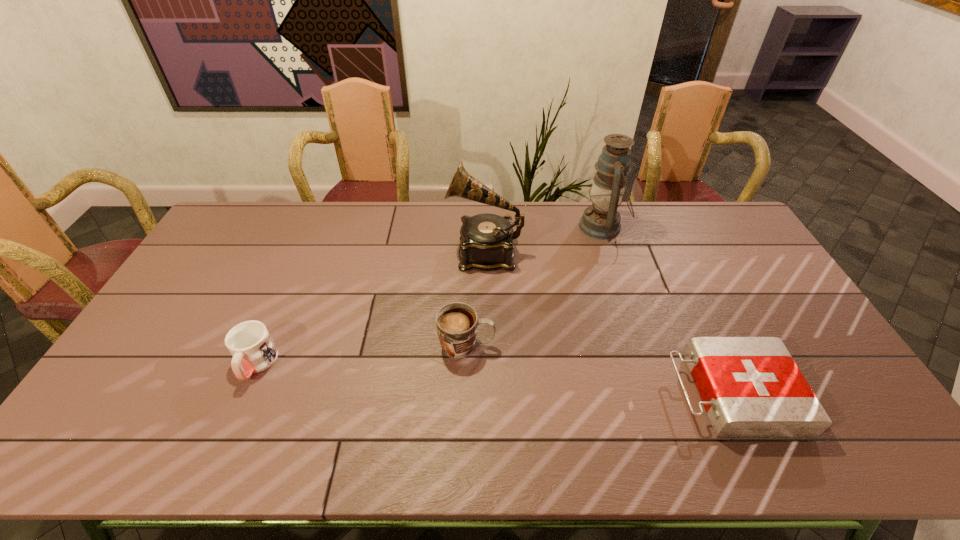
Where is `vacant region located 0.270m on the horn of the phonograph record`? vacant region located 0.270m on the horn of the phonograph record is located at coordinates (370, 252).

Where is `vacant space situated on the side of the taller mug with the handle`? This screenshot has height=540, width=960. vacant space situated on the side of the taller mug with the handle is located at coordinates (595, 346).

I want to click on vacant space located on the side of the left mug with the handle, so tap(233, 416).

Find the location of `free space located on the front side of the shortest object`. free space located on the front side of the shortest object is located at coordinates point(575,394).

Identify the location of free space located 0.120m on the front side of the shortest object. This screenshot has width=960, height=540. (626, 394).

At what (x,y) coordinates should I click in order to perform the action: click on free space located on the front side of the shortest object. Please return your answer as a coordinate pair (x, y). This screenshot has height=540, width=960. Looking at the image, I should click on (567, 394).

In order to click on oil lamp at the far edge in this screenshot , I will do pyautogui.click(x=601, y=220).

This screenshot has width=960, height=540. Find the location of `phonograph record that is at the far edge`. phonograph record that is at the far edge is located at coordinates (486, 239).

Where is `object situated at the near edge`? This screenshot has width=960, height=540. object situated at the near edge is located at coordinates (751, 388).

I want to click on object present at the right edge, so click(x=751, y=388).